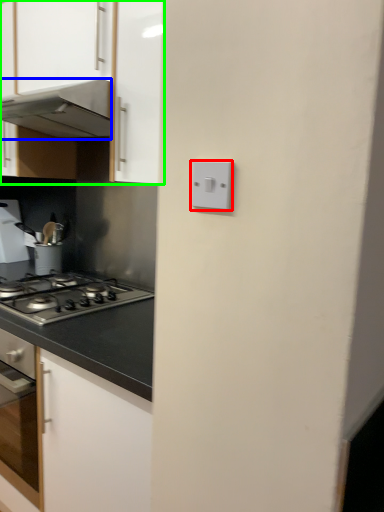
Question: Based on their relative distances, which object is farther from light switch (highlighted by a red box)? Choose from home appliance (highlighted by a blue box) and cabinetry (highlighted by a green box).

Choices:
 (A) home appliance
 (B) cabinetry

Answer: (A)